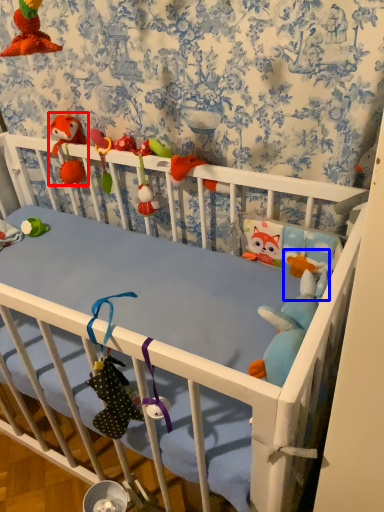
Question: Which point is further to the camera, toy (highlighted by a red box) or toy (highlighted by a blue box)?

Choices:
 (A) toy
 (B) toy

Answer: (A)